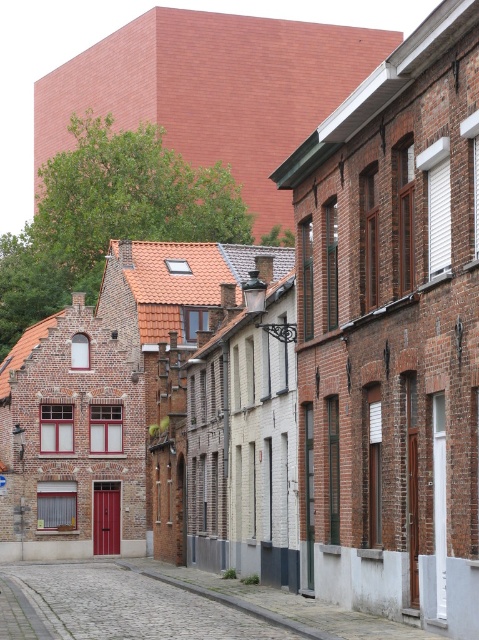
You are standing at the starting point of the cobblestone street in the European town scene. You want to walk directly towards the brick building at center. According to the coordinates provided, in which direction should you head? Please specify left, right, forward, backward, or a combination of these directions.

The brick building at center is located at coordinates point (392, 332). Since the street curves gently to the left and the building is at the center, you should head forward along the curved path to reach it.

You are a delivery person trying to park your 2.5 meter wide delivery van on the cobblestone street at center. The brick building at center is right next to the street. Can you park your van there without hitting the building?

The brick building at center is narrower than the cobblestone street at center, so the building is not wide enough to block the entire street. However, since the building is adjacent to the street, you need to ensure there is enough space between the building and the street edge to park the van without hitting it. The description only mentions the building is narrower than the street, but doesn

You are a tourist standing at the start of the cobblestone street at center and want to take a photo of the brick building at center. In which direction should you walk to position yourself correctly for the photo?

You should walk to the left along the cobblestone street at center because the brick building at center is located to the right of the street, so moving left will allow you to face it properly.